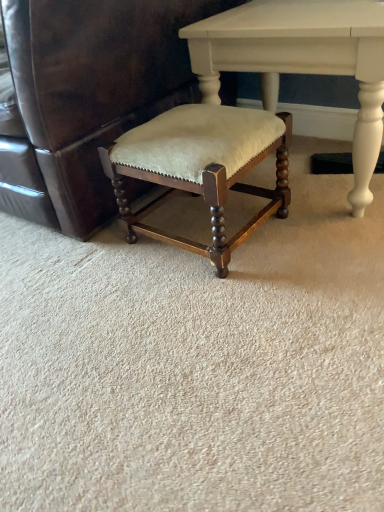
Where is `vacant space underneath matte white table at center (from a real-world perspective)`? vacant space underneath matte white table at center (from a real-world perspective) is located at coordinates (316, 175).